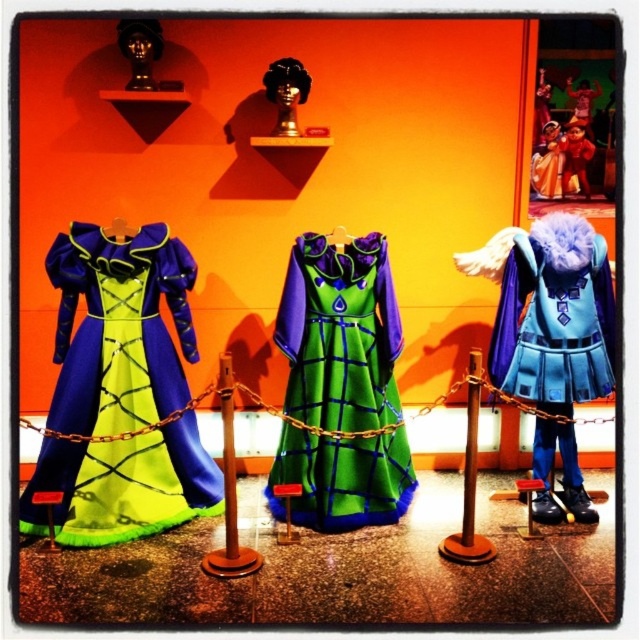
You are a visitor at the costume exhibit and want to take a photo of the blue velvet cape at center without the brown wooden pole at center blocking the view. Is the pole too big to move out of the way?

The brown wooden pole at center is larger in size than the blue velvet cape at center, so it might be difficult to move the pole out of the way for your photo.

You are a visitor at the costume exhibit and want to take a photo of both the brown wooden pole at center and the brushed metal pole at center. Which pole should you position to your left side to include both in the frame?

To include both the brown wooden pole at center and the brushed metal pole at center in your photo, position the brushed metal pole at center to your left side since the brown wooden pole at center is to the right of it.

You are standing at the entrance of the costume exhibit. You see the brown wooden pole at center. Can you estimate its position in the image using coordinates?

The brown wooden pole at center is located at coordinates approximately 0.730 on the x axis and 0.738 on the y axis.